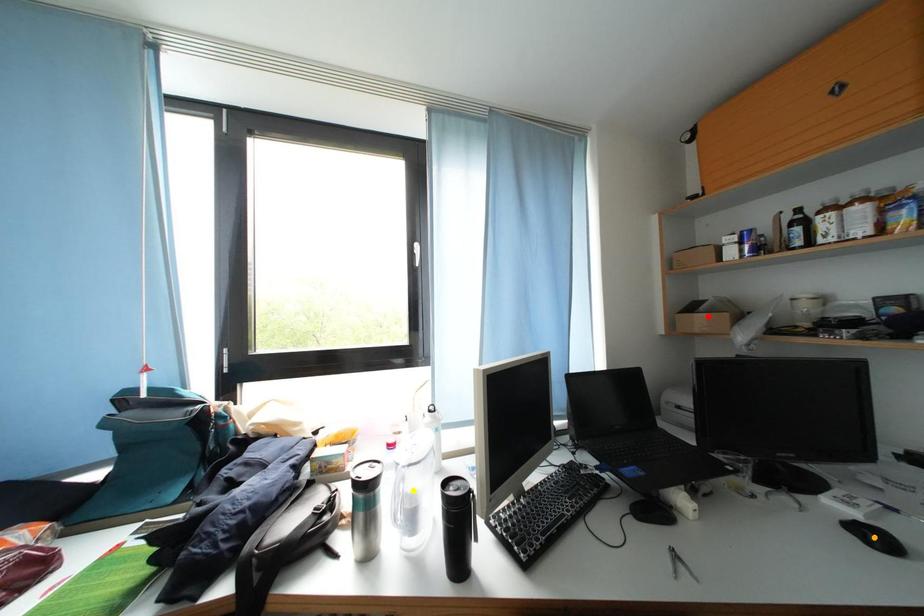
Order these from nearest to farthest:
- orange point
- yellow point
- red point

1. red point
2. yellow point
3. orange point